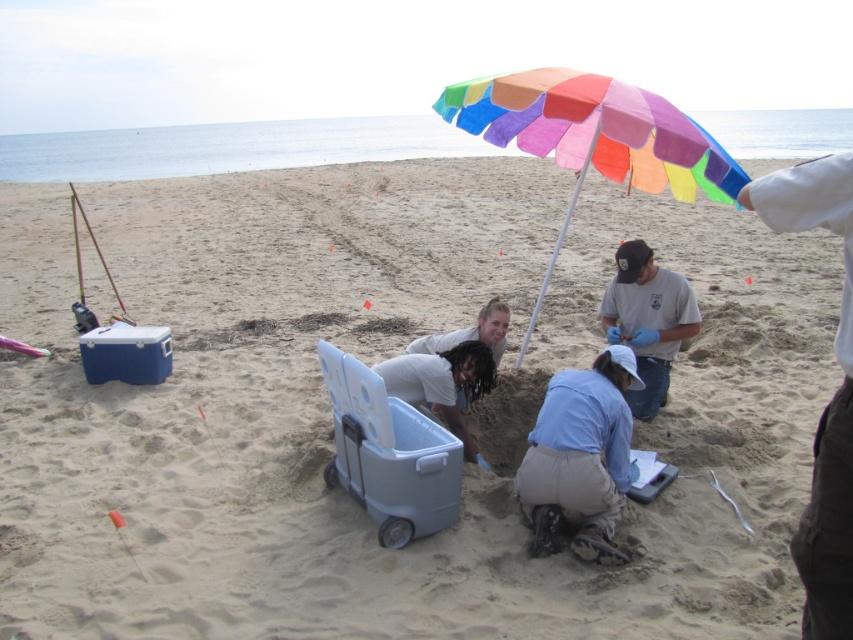
You are a researcher on the beach and need to set up a temporary workstation. You have a clipboard and a cooler. Where should you place the rainbow fabric umbrella at center to provide shade for both the clipboard and the cooler?

The rainbow fabric umbrella at center should be placed at point (595, 129) to provide shade for both the clipboard and the cooler.

You are a beachgoer who wants to set up your beach umbrella so that it provides shade over the gray plastic cooler at center. Given that the umbrella has a diameter of 2 meters, will the rainbow fabric umbrella at center currently positioned 1.64 meters away from the cooler be sufficient to cover it?

The rainbow fabric umbrella at center is 1.64 meters away from the gray plastic cooler at center. Since the umbrella has a diameter of 2 meters, its radius is 1 meter. The distance between them is 1.64 meters, which is greater than the radius of 1 meter. Therefore, the umbrella will not fully cover the gray plastic cooler at center.

You are a photographer trying to capture a shot of the gray plastic cooler at center and the rainbow fabric umbrella at center. From which side of the cooler should you position yourself to have both objects in frame without moving the camera?

You should position yourself to the right of the gray plastic cooler at center so that both the gray plastic cooler at center and the rainbow fabric umbrella at center to its right are in frame.